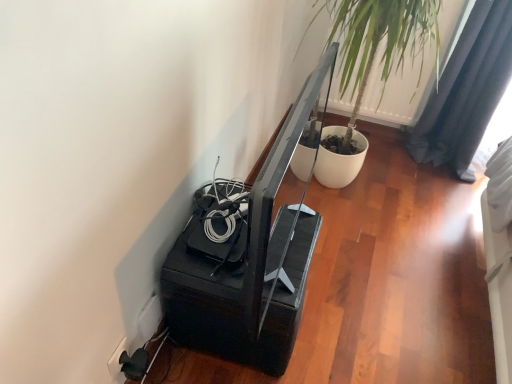
The image size is (512, 384). Identify the location of vacant area that is in front of dark gray fabric curtain at upper right. (439, 190).